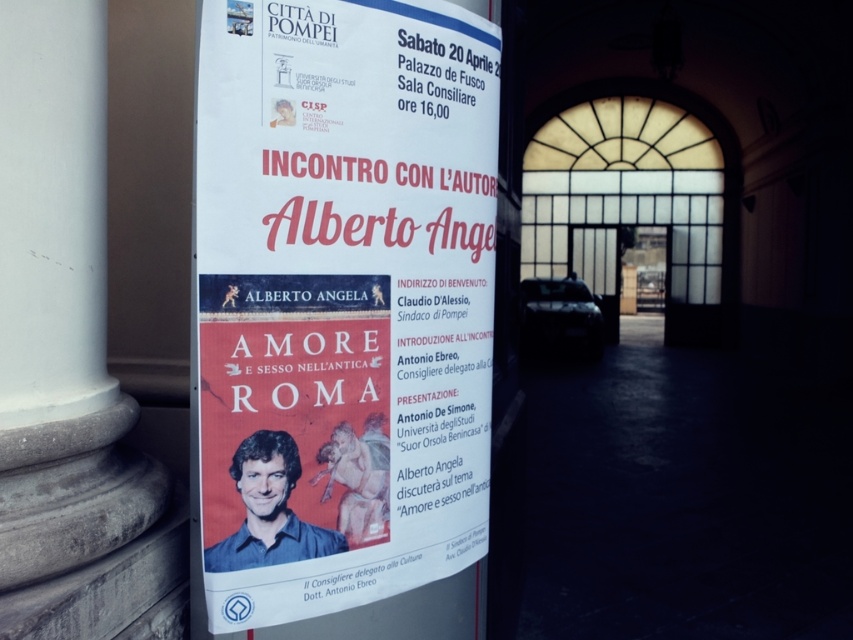
Question: Does white paper poster at center appear on the right side of white marble pillar at left?

Choices:
 (A) yes
 (B) no

Answer: (A)

Question: Can you confirm if white paper poster at center is positioned above white marble pillar at left?

Choices:
 (A) no
 (B) yes

Answer: (A)

Question: From the image, what is the correct spatial relationship of white paper poster at center in relation to white marble pillar at left?

Choices:
 (A) left
 (B) right

Answer: (B)

Question: Which point is farther to the camera?

Choices:
 (A) (47, 104)
 (B) (207, 61)

Answer: (B)

Question: Which of the following is the farthest from the observer?

Choices:
 (A) (62, 29)
 (B) (448, 323)

Answer: (B)